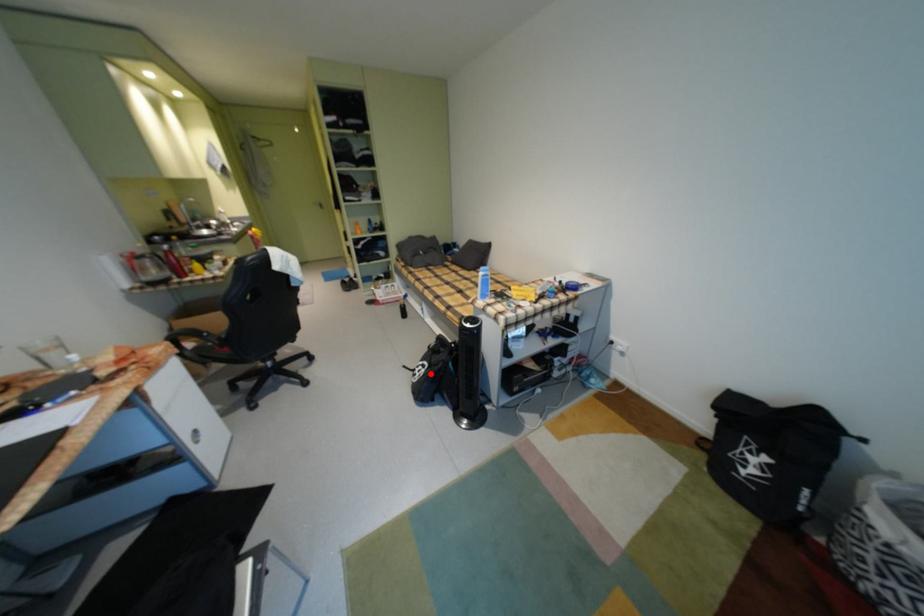
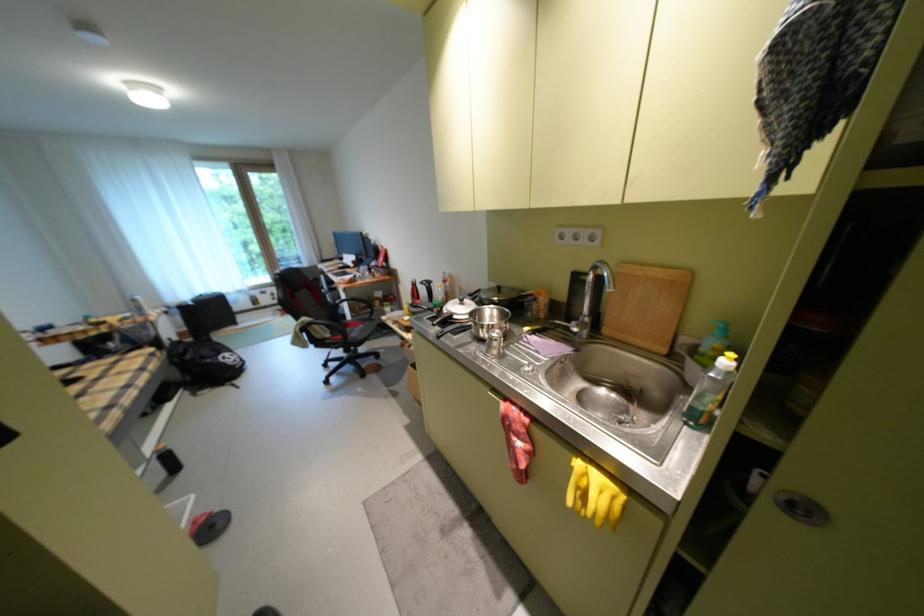
In the second image, find the point that corresponds to the highlighted location in the first image.

(239, 358)